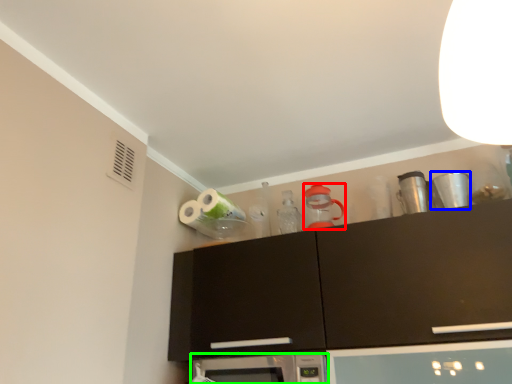
Question: Which object is the farthest from appliance (highlighted by a red box)? Choose among these: appliance (highlighted by a blue box) or microwave oven (highlighted by a green box).

Choices:
 (A) appliance
 (B) microwave oven

Answer: (B)